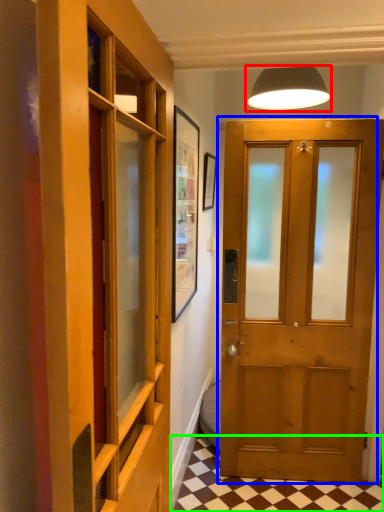
Question: Considering the real-world distances, which object is closest to lamp (highlighted by a red box)? door (highlighted by a blue box) or tile (highlighted by a green box).

Choices:
 (A) door
 (B) tile

Answer: (A)